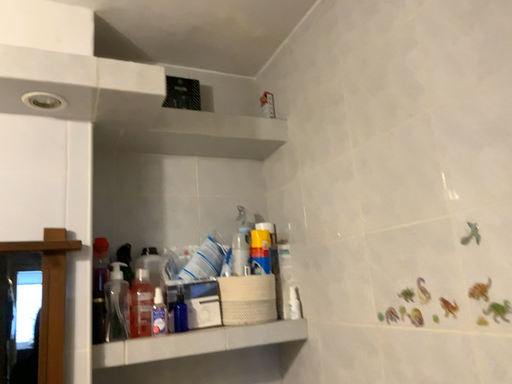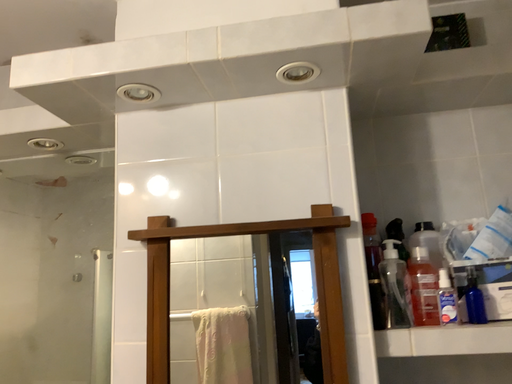
Question: How did the camera likely rotate when shooting the video?

Choices:
 (A) rotated right
 (B) rotated left

Answer: (B)